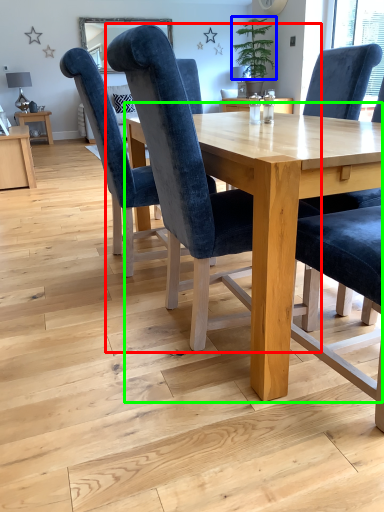
Question: Which object is positioned closest to chair (highlighted by a red box)? Select from plant (highlighted by a blue box) and table (highlighted by a green box).

Choices:
 (A) plant
 (B) table

Answer: (B)